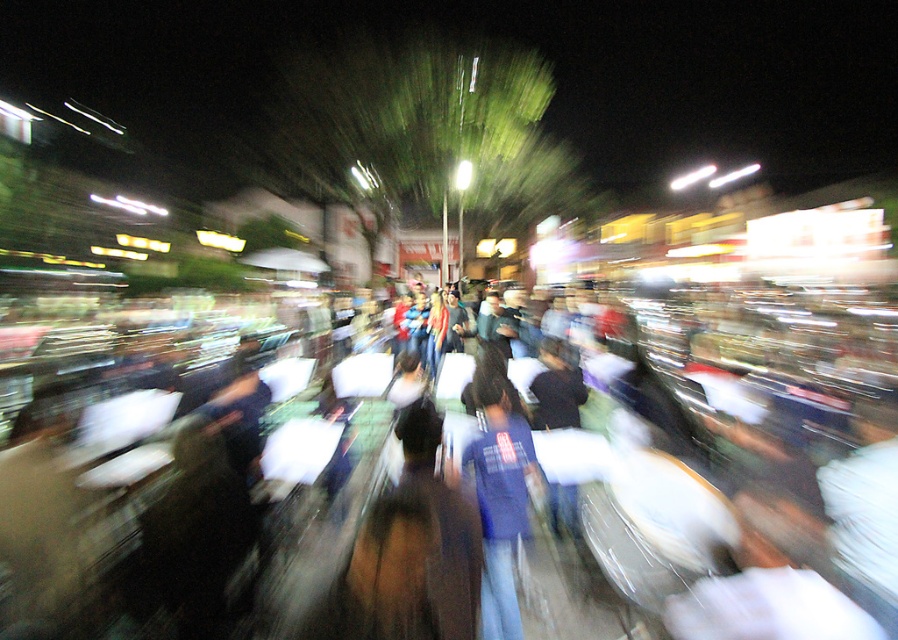
Question: Can you confirm if white cotton pillows at center is positioned above blue cotton shirt at center?

Choices:
 (A) yes
 (B) no

Answer: (B)

Question: Among these points, which one is nearest to the camera?

Choices:
 (A) (286, 442)
 (B) (492, 522)

Answer: (B)

Question: Which object is farther from the camera taking this photo?

Choices:
 (A) blue cotton shirt at center
 (B) white cotton pillows at center

Answer: (B)

Question: Can you confirm if white cotton pillows at center is thinner than blue cotton shirt at center?

Choices:
 (A) no
 (B) yes

Answer: (A)

Question: Can you confirm if white cotton pillows at center is positioned to the left of blue cotton shirt at center?

Choices:
 (A) yes
 (B) no

Answer: (B)